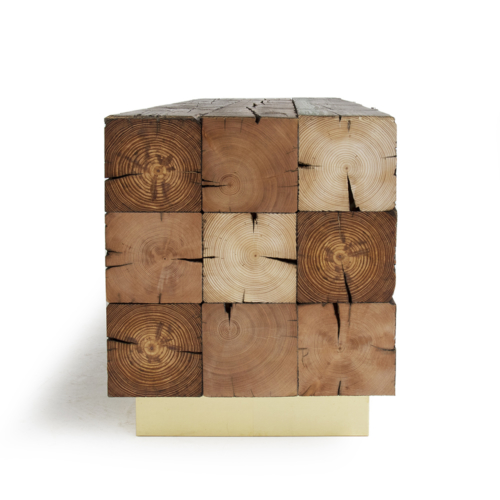
Image resolution: width=500 pixels, height=500 pixels. I want to click on wooden boards, so click(187, 196), click(272, 186), click(320, 204), click(319, 239).